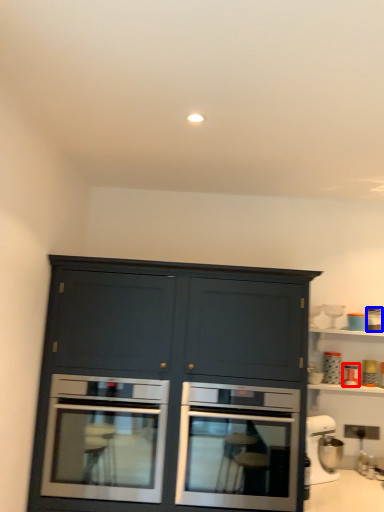
Question: Which of the following is the closest to the observer, appliance (highlighted by a red box) or appliance (highlighted by a blue box)?

Choices:
 (A) appliance
 (B) appliance

Answer: (A)